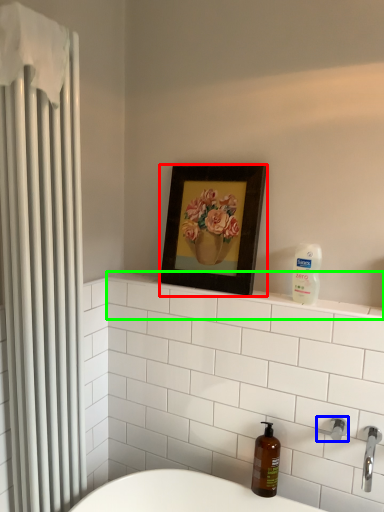
Question: Considering the real-world distances, which object is farthest from picture frame (highlighted by a red box)? shower (highlighted by a blue box) or balustrade (highlighted by a green box)?

Choices:
 (A) shower
 (B) balustrade

Answer: (A)